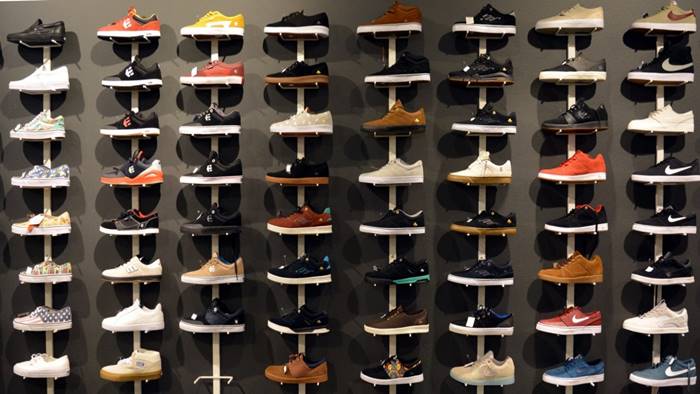
This screenshot has height=394, width=700. Identify the location of shoe on bottom row. (45, 368), (127, 365), (297, 365), (390, 369), (481, 370), (565, 369), (658, 370).